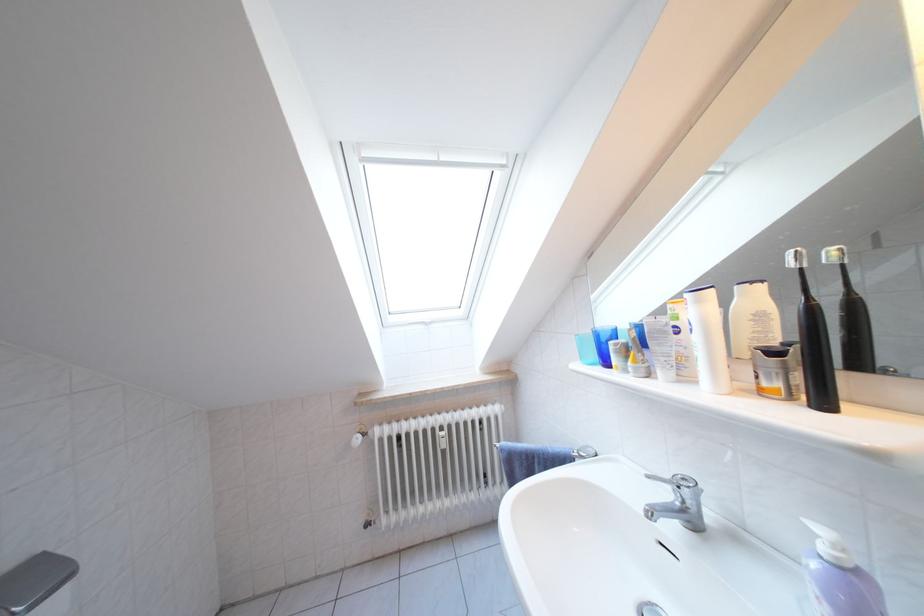
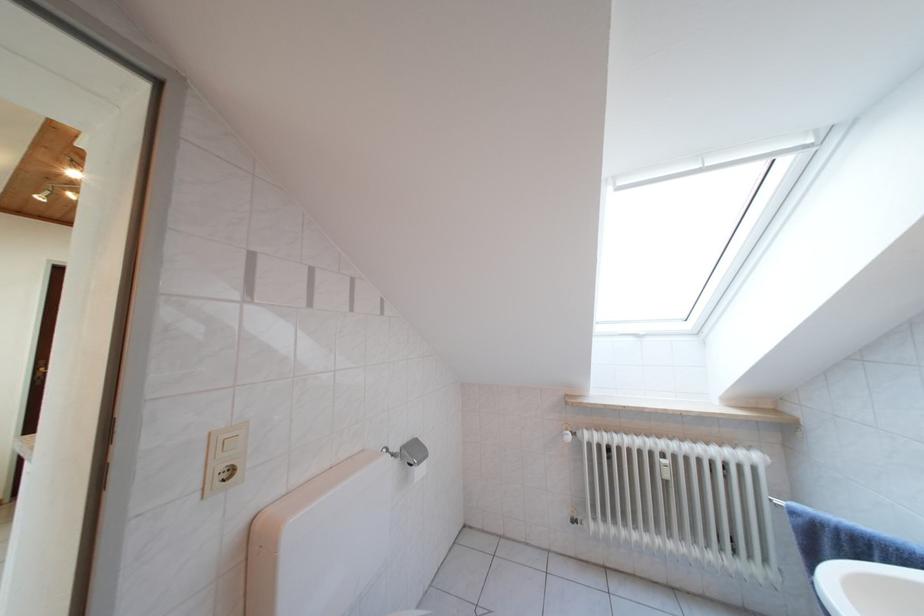
Question: The camera is either moving clockwise (left) or counter-clockwise (right) around the object. The first image is from the beginning of the video and the second image is from the end. Is the camera moving left or right when shooting the video?

Choices:
 (A) Left
 (B) Right

Answer: (B)